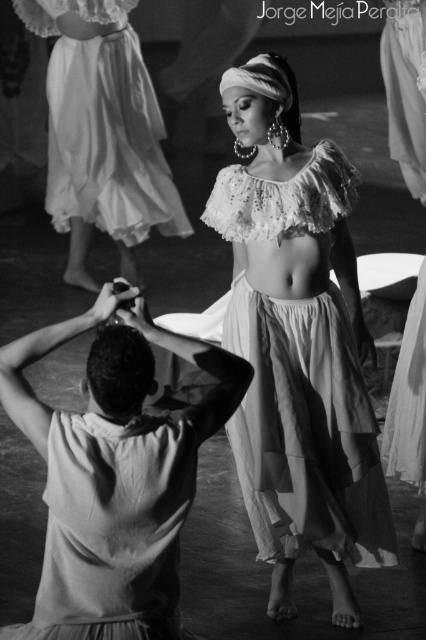
Question: Which point is closer to the camera taking this photo?

Choices:
 (A) (224, 364)
 (B) (86, 156)

Answer: (A)

Question: Which point is closer to the camera taking this photo?

Choices:
 (A) (103, 80)
 (B) (20, 381)
 (C) (331, 472)

Answer: (B)

Question: Which point is closer to the camera?

Choices:
 (A) matte white fabric skirt at center
 (B) light beige fabric skirt at center

Answer: (B)

Question: Does matte white fabric skirt at center have a larger size compared to white sheer skirt at center?

Choices:
 (A) yes
 (B) no

Answer: (A)

Question: Observing the image, what is the correct spatial positioning of light beige fabric skirt at center in reference to white sheer skirt at upper center?

Choices:
 (A) below
 (B) above

Answer: (A)

Question: Can you confirm if light beige fabric skirt at center is bigger than white sheer skirt at upper center?

Choices:
 (A) yes
 (B) no

Answer: (B)